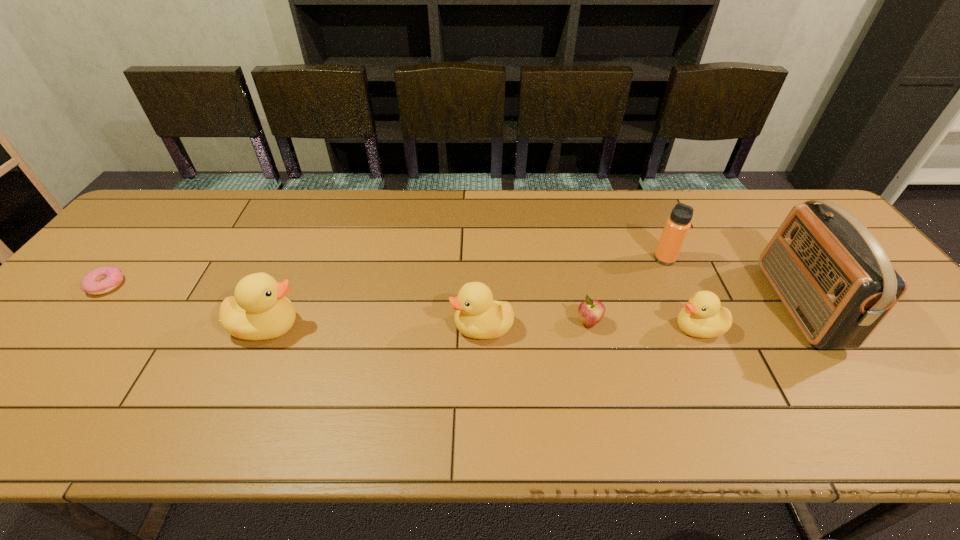
Where is `the second shortest object`? The image size is (960, 540). the second shortest object is located at coordinates click(x=590, y=311).

I want to click on the fourth object from left to right, so click(590, 311).

Locate an element on the screen. This screenshot has height=540, width=960. vacant region located 0.380m on the face of the second object from left to right is located at coordinates (459, 326).

Locate an element on the screen. The width and height of the screenshot is (960, 540). free space located 0.130m on the face of the third object from left to right is located at coordinates (397, 327).

Identify the location of vacant region located on the face of the third object from left to right. Image resolution: width=960 pixels, height=540 pixels. (397, 327).

Locate an element on the screen. The image size is (960, 540). vacant space located on the face of the third object from left to right is located at coordinates (385, 327).

Where is `vacant space situated 0.390m on the face of the shortest duckling`? vacant space situated 0.390m on the face of the shortest duckling is located at coordinates (512, 328).

This screenshot has width=960, height=540. In order to click on free spot located on the face of the shortest duckling in this screenshot , I will do `click(561, 328)`.

Where is `blank area located 0.390m on the face of the shortest duckling`? blank area located 0.390m on the face of the shortest duckling is located at coordinates (512, 328).

In order to click on vacant point located on the back of the thermos bottle in this screenshot , I will do `click(637, 195)`.